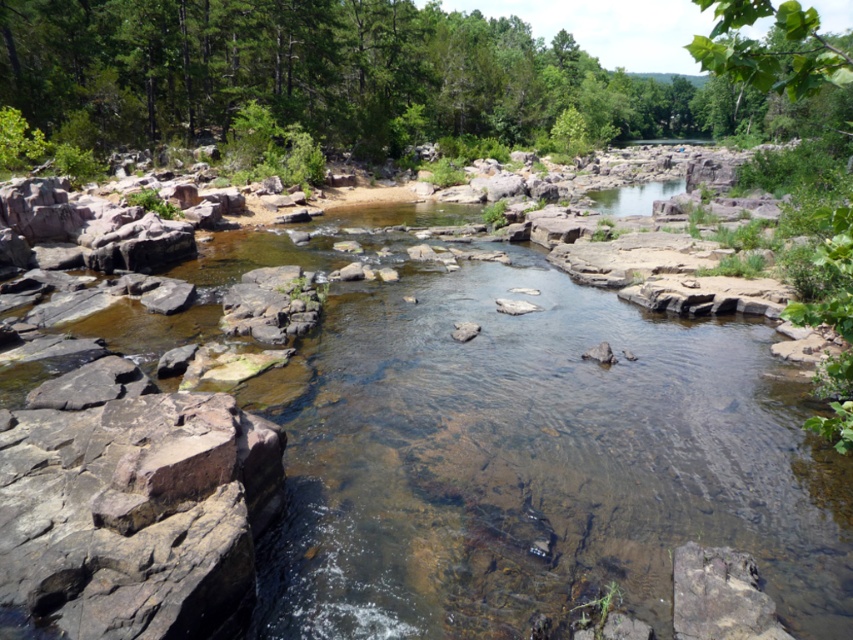
You are a hiker trying to cross the river. You see the green leafy tree at upper right and the clear water at center. Which object is bigger in size?

The green leafy tree at upper right is larger in size than the clear water at center.

You are standing at the edge of the river and see two points on the riverbed marked as point (844, 314) and point (653, 182). Which point is closer to you?

Point (844, 314) is closer to the viewer than point (653, 182).

You are a hiker who wants to cross the river using the clear water at center. There is a green leafy tree at upper right nearby. Which direction should you head relative to the tree to reach the water?

The green leafy tree at upper right is located above the clear water at center, so you should head downward from the tree to reach the water.